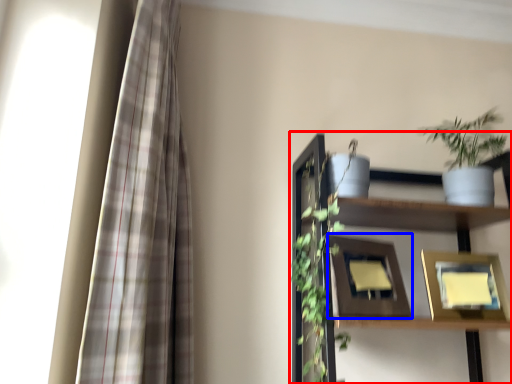
Question: Which of the following is the farthest to the observer, shelf (highlighted by a red box) or picture frame (highlighted by a blue box)?

Choices:
 (A) shelf
 (B) picture frame

Answer: (B)